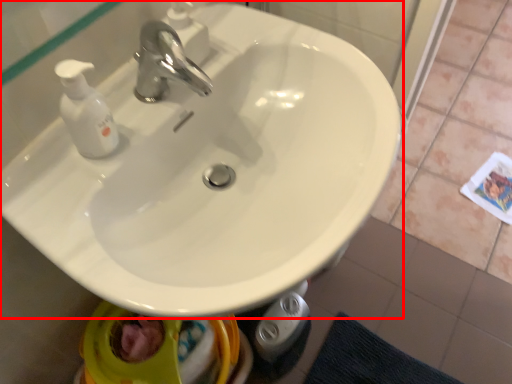
Question: From the image's perspective, considering the relative positions of sink (annotated by the red box) and tap in the image provided, where is sink (annotated by the red box) located with respect to the staircase?

Choices:
 (A) below
 (B) above

Answer: (A)